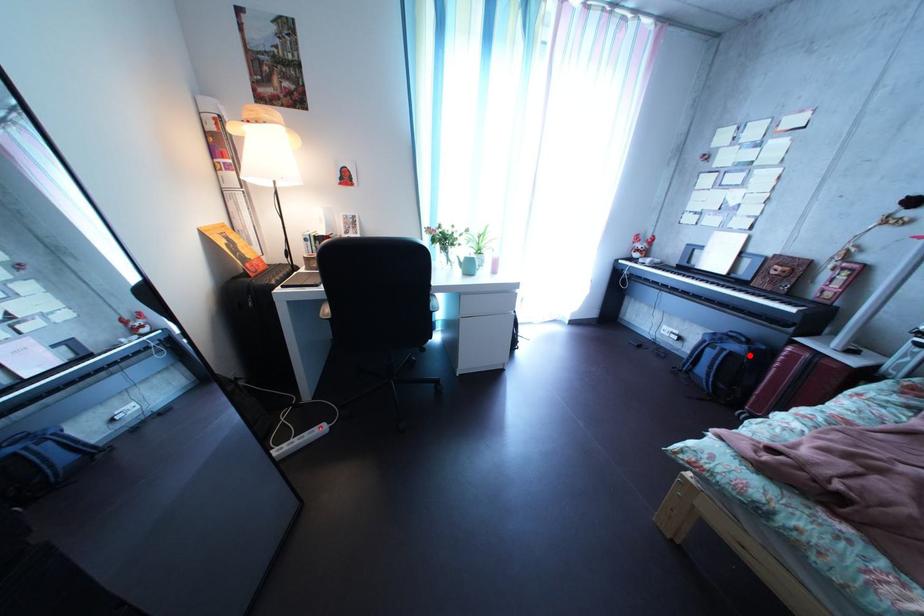
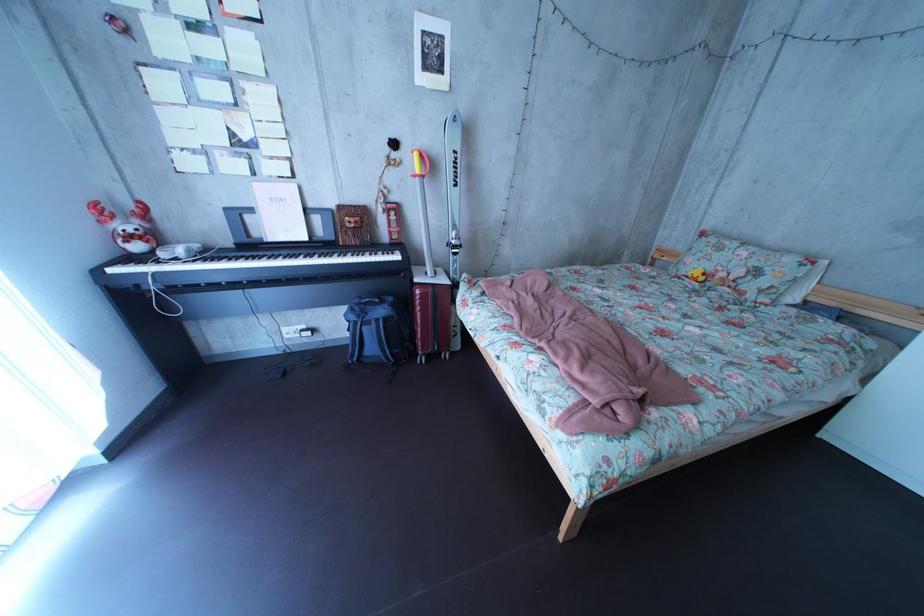
In the second image, find the point that corresponds to the highlighted location in the first image.

(395, 320)